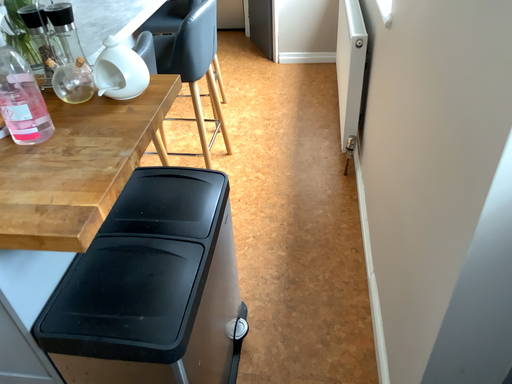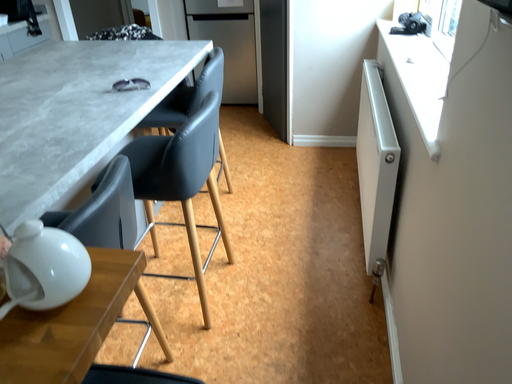
Question: How did the camera likely rotate when shooting the video?

Choices:
 (A) rotated downward
 (B) rotated upward

Answer: (B)